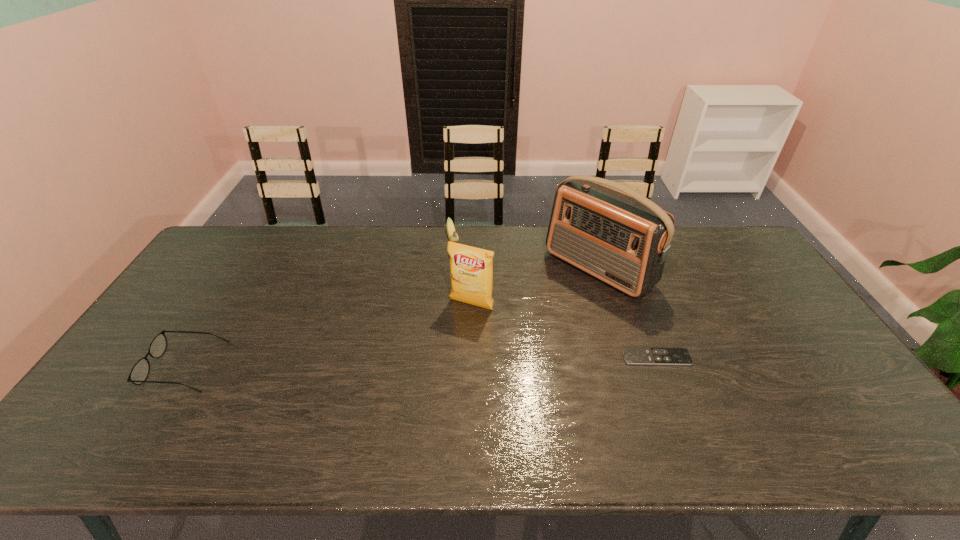
The width and height of the screenshot is (960, 540). What are the coordinates of `vacant space that is in between the radio receiver and the remote control` in the screenshot? It's located at (627, 313).

Find the location of a particular element. free space between the crisp (potato chip) and the radio receiver is located at coordinates (535, 287).

This screenshot has height=540, width=960. What are the coordinates of `blank region between the shortest object and the banana` in the screenshot? It's located at (555, 299).

Locate an element on the screen. This screenshot has width=960, height=540. object that stands as the second closest to the remote control is located at coordinates (471, 268).

Where is `object that is the nearest to the crisp (potato chip)`? object that is the nearest to the crisp (potato chip) is located at coordinates (623, 239).